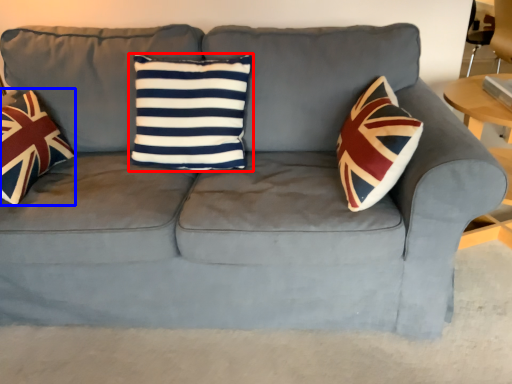
Question: Among these objects, which one is farthest to the camera, pillow (highlighted by a red box) or throw pillow (highlighted by a blue box)?

Choices:
 (A) pillow
 (B) throw pillow

Answer: (A)